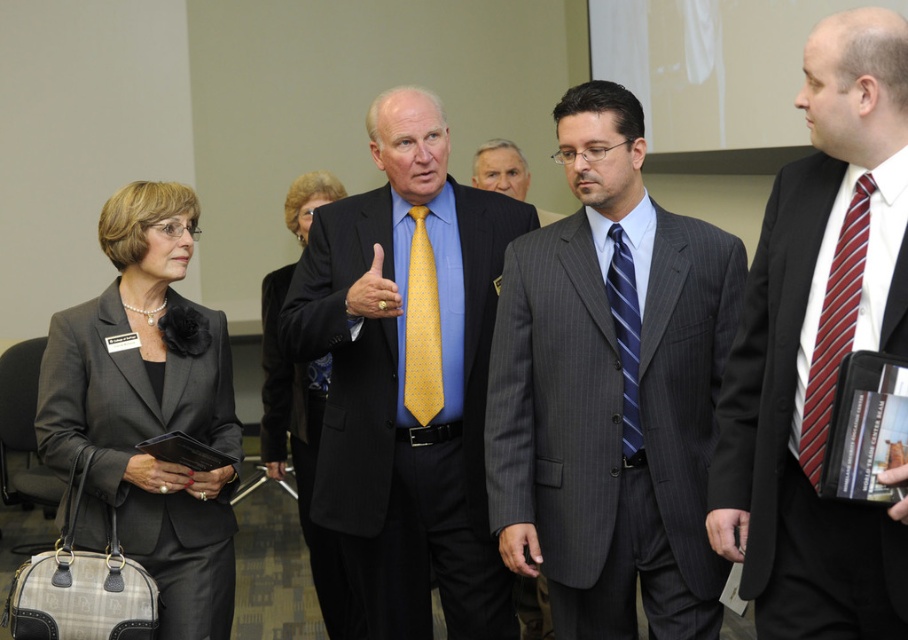
Based on the photo, based on the provided coordinates, which object is located at point (612, 417) in the scene?

The point (612, 417) corresponds to the gray pinstripe suit at center.

In the conference room scene, there are two central items of clothing displayed on a person. These are the matte black suit at center and the blue striped tie at center. Which of these two items is positioned lower on the person?

The matte black suit at center is located below the blue striped tie at center, so the matte black suit at center is positioned lower.

You are organizing a charity event and need to arrange seating based on the formality of attire. The person wearing the matte black suit at center is seated to the right of the blue striped tie at center. Which person should be seated closer to the head table?

The matte black suit at center should be seated closer to the head table because its width is larger than the blue striped tie at center, indicating a more formal attire.